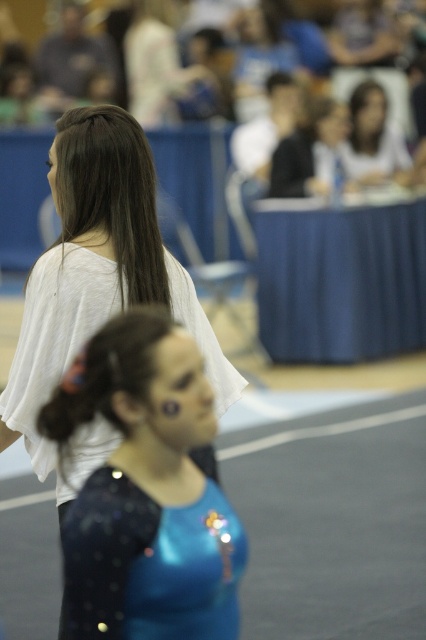
Can you confirm if shiny blue leotard at lower center is positioned to the right of matte white shirt at upper center?

No, shiny blue leotard at lower center is not to the right of matte white shirt at upper center.

Does shiny blue leotard at lower center have a smaller size compared to matte white shirt at upper center?

Indeed, shiny blue leotard at lower center has a smaller size compared to matte white shirt at upper center.

This screenshot has width=426, height=640. What do you see at coordinates (149, 563) in the screenshot? I see `shiny blue leotard at lower center` at bounding box center [149, 563].

Where is `shiny blue leotard at lower center`? The height and width of the screenshot is (640, 426). shiny blue leotard at lower center is located at coordinates pos(149,563).

Can you confirm if shiny blue leotard at center is positioned above matte white shirt at upper center?

No.

What do you see at coordinates (146, 490) in the screenshot? The image size is (426, 640). I see `shiny blue leotard at center` at bounding box center [146, 490].

Identify the location of shiny blue leotard at center. (146, 490).

The height and width of the screenshot is (640, 426). Find the location of `shiny blue leotard at center`. shiny blue leotard at center is located at coordinates [146, 490].

Does shiny blue leotard at center appear on the left side of shiny blue leotard at lower center?

Correct, you'll find shiny blue leotard at center to the left of shiny blue leotard at lower center.

Which of these two, shiny blue leotard at center or shiny blue leotard at lower center, stands taller?

With more height is shiny blue leotard at center.

Who is more distant from viewer, (x=135, y=324) or (x=143, y=492)?

The point (x=135, y=324) is behind.

You are a GUI agent. You are given a task and a screenshot of the screen. Output one action in this format:
    pyautogui.click(x=<x>, y=<y>)
    Task: Click on the shiny blue leotard at center
    Image resolution: width=426 pixels, height=640 pixels.
    Given the screenshot: What is the action you would take?
    pyautogui.click(x=146, y=490)